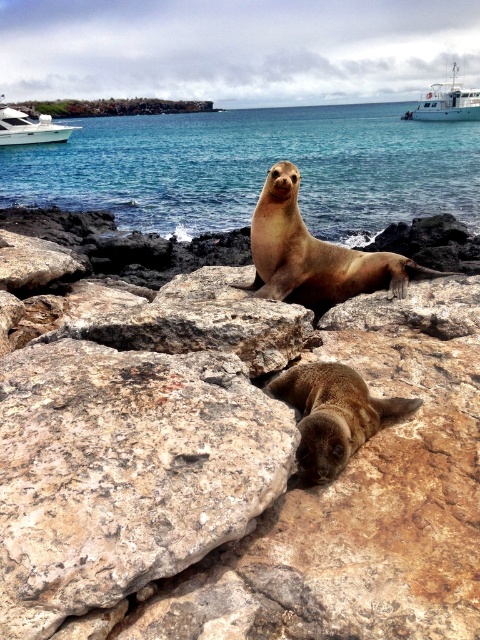
Is the position of brown fur seal at center less distant than that of white glossy boat at upper left?

Yes.

Which is more to the right, brown fur seal at center or white glossy boat at upper left?

brown fur seal at center is more to the right.

Does point (336, 288) come farther from viewer compared to point (45, 132)?

No, it is in front of (45, 132).

Find the location of a particular element. The width and height of the screenshot is (480, 640). brown fur seal at center is located at coordinates (314, 253).

Does rough textured rock at center appear over white glossy boat at upper left?

No.

Can you confirm if rough textured rock at center is taller than white glossy boat at upper left?

In fact, rough textured rock at center may be shorter than white glossy boat at upper left.

Is point (3, 374) farther from camera compared to point (33, 128)?

No.

Identify the location of rough textured rock at center. (123, 472).

Describe the element at coordinates (253, 168) in the screenshot. This screenshot has width=480, height=640. I see `blue water at center` at that location.

Looking at this image, is blue water at center above green mossy rocks at upper center?

No, blue water at center is not above green mossy rocks at upper center.

Measure the distance between blue water at center and camera.

blue water at center and camera are 35.29 feet apart.

The image size is (480, 640). I want to click on blue water at center, so click(253, 168).